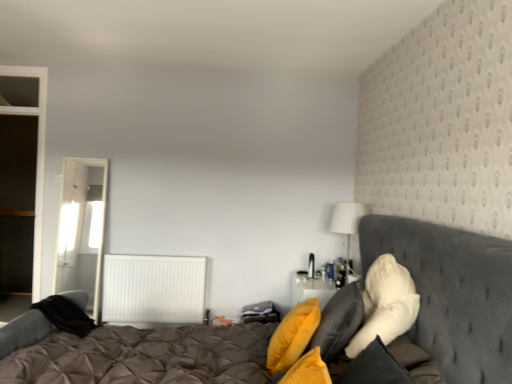
Question: Looking at the image, does white textured radiator at center seem bigger or smaller compared to tufted fabric bed at center?

Choices:
 (A) big
 (B) small

Answer: (B)

Question: From the image's perspective, is white textured radiator at center located above or below tufted fabric bed at center?

Choices:
 (A) below
 (B) above

Answer: (A)

Question: Which object is positioned closest to the white fabric lampshade at upper right?

Choices:
 (A) yellow fabric pillow at center, acting as the first pillow starting from the left
 (B) white textured radiator at center
 (C) white fluffy pillow at right, marked as the first pillow in a right-to-left arrangement
 (D) tufted fabric bed at center
 (E) soft yellow pillow at right, the second pillow viewed from the left

Answer: (C)

Question: Considering the real-world distances, which object is farthest from the tufted fabric bed at center?

Choices:
 (A) white sheer curtain at left
 (B) white fabric lampshade at upper right
 (C) yellow fabric pillow at center, the third pillow when ordered from right to left
 (D) soft yellow pillow at right, the second pillow viewed from the left
 (E) white textured radiator at center

Answer: (A)